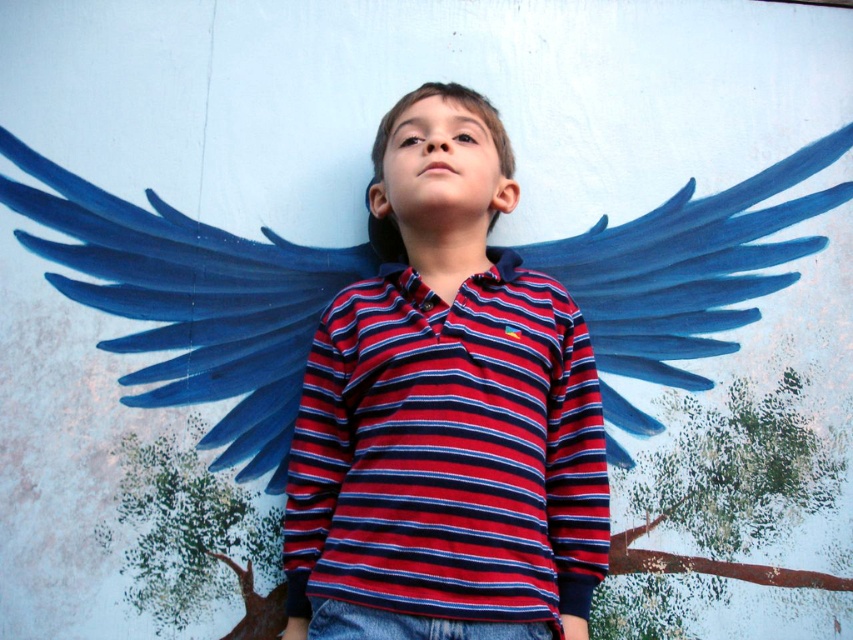
Can you confirm if red striped shirt at center is positioned to the right of blue matte wings at upper center?

Indeed, red striped shirt at center is positioned on the right side of blue matte wings at upper center.

Can you confirm if red striped shirt at center is wider than blue matte wings at upper center?

No, red striped shirt at center is not wider than blue matte wings at upper center.

Which is behind, point (374, 404) or point (231, 356)?

Positioned behind is point (231, 356).

You are a GUI agent. You are given a task and a screenshot of the screen. Output one action in this format:
    pyautogui.click(x=<x>, y=<y>)
    Task: Click on the red striped shirt at center
    The image size is (853, 640).
    Given the screenshot: What is the action you would take?
    pyautogui.click(x=445, y=413)